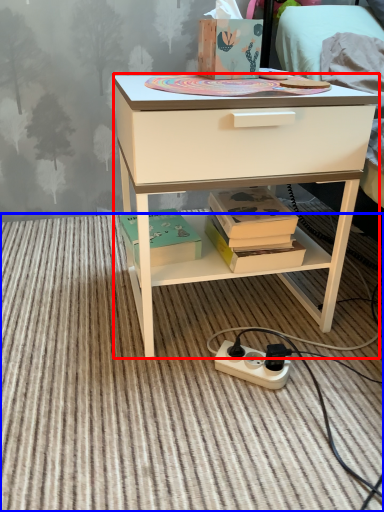
Question: Among these objects, which one is farthest to the camera, desk (highlighted by a red box) or plain (highlighted by a blue box)?

Choices:
 (A) desk
 (B) plain

Answer: (A)